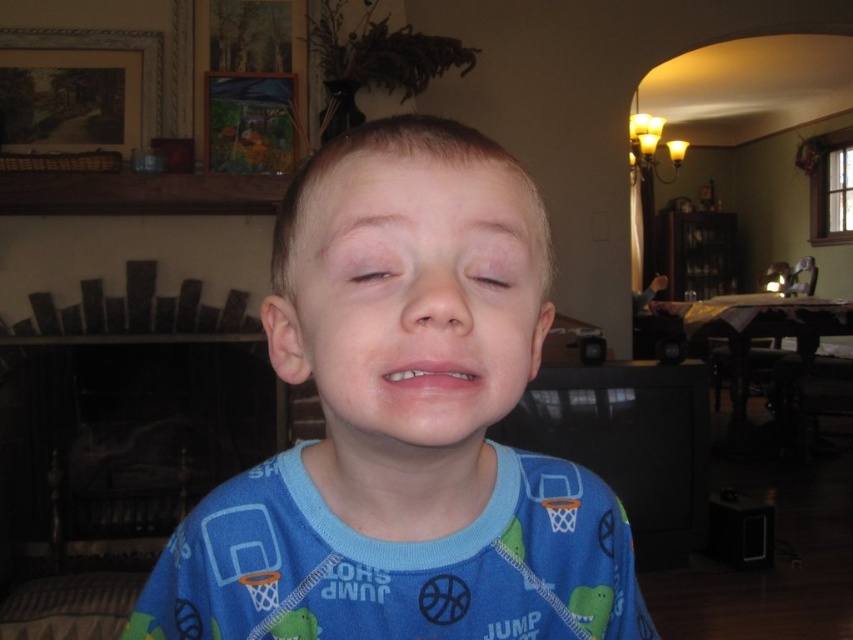
Question: Which point appears farthest from the camera in this image?

Choices:
 (A) (466, 241)
 (B) (428, 321)

Answer: (A)

Question: Is blue cotton shirt at center positioned in front of light brown skin at center?

Choices:
 (A) yes
 (B) no

Answer: (B)

Question: Among these objects, which one is nearest to the camera?

Choices:
 (A) light brown skin at center
 (B) blue cotton shirt at center
 (C) blue cotton pajamas at center

Answer: (C)

Question: Can you confirm if smooth flesh nose at center is wider than matte skin at center?

Choices:
 (A) no
 (B) yes

Answer: (B)

Question: Does smooth flesh nose at center have a smaller size compared to matte skin at center?

Choices:
 (A) yes
 (B) no

Answer: (B)

Question: Which object appears farthest from the camera in this image?

Choices:
 (A) smooth flesh nose at center
 (B) blue cotton shirt at center
 (C) blue cotton pajamas at center
 (D) blue fabric face at center

Answer: (B)